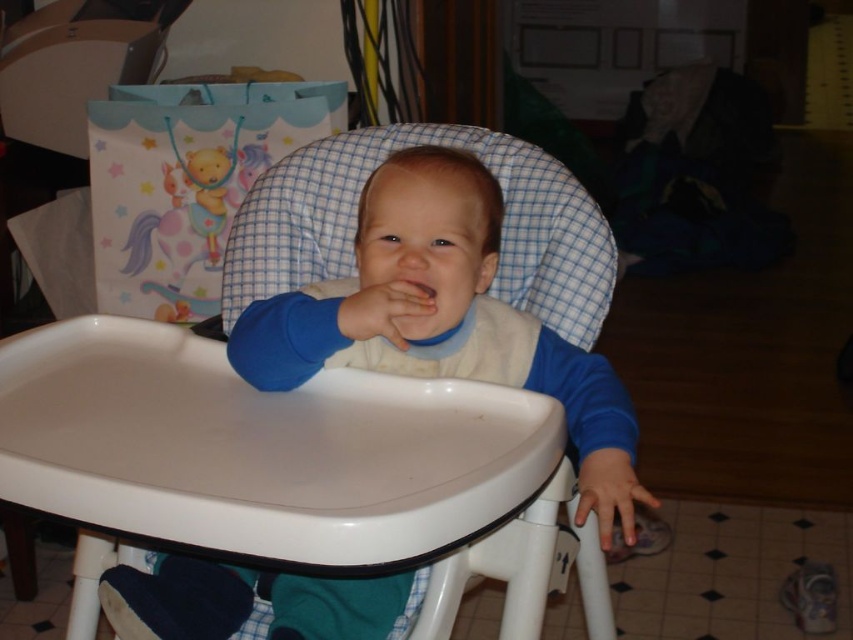
Question: Estimate the real-world distances between objects in this image. Which object is farther from the pink matte flesh at center?

Choices:
 (A) matte blue sleeve at center
 (B) smooth skin hand at lower right

Answer: (B)

Question: Which of the following is the closest to the observer?

Choices:
 (A) pink matte flesh at center
 (B) smooth skin hand at lower right

Answer: (B)

Question: Which is nearer to the blue cotton bib at center?

Choices:
 (A) pink matte flesh at center
 (B) matte blue sleeve at center
 (C) smooth skin hand at lower right

Answer: (B)

Question: Considering the relative positions of matte blue sleeve at center and pink matte flesh at center in the image provided, where is matte blue sleeve at center located with respect to pink matte flesh at center?

Choices:
 (A) above
 (B) below

Answer: (B)

Question: Can you confirm if blue cotton bib at center is bigger than matte blue sleeve at center?

Choices:
 (A) no
 (B) yes

Answer: (B)

Question: Where is blue cotton bib at center located in relation to matte blue sleeve at center in the image?

Choices:
 (A) above
 (B) below

Answer: (A)